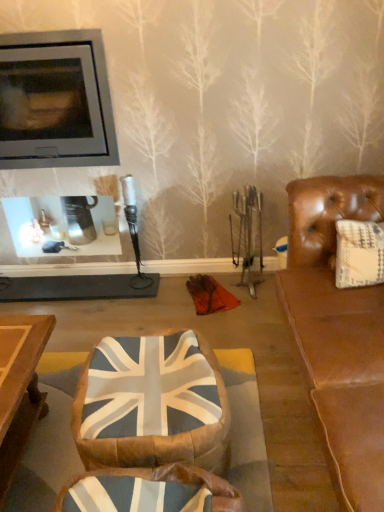
Locate an element on the screen. This screenshot has height=512, width=384. vacant space to the right of union jack fabric bean bag at center is located at coordinates (271, 434).